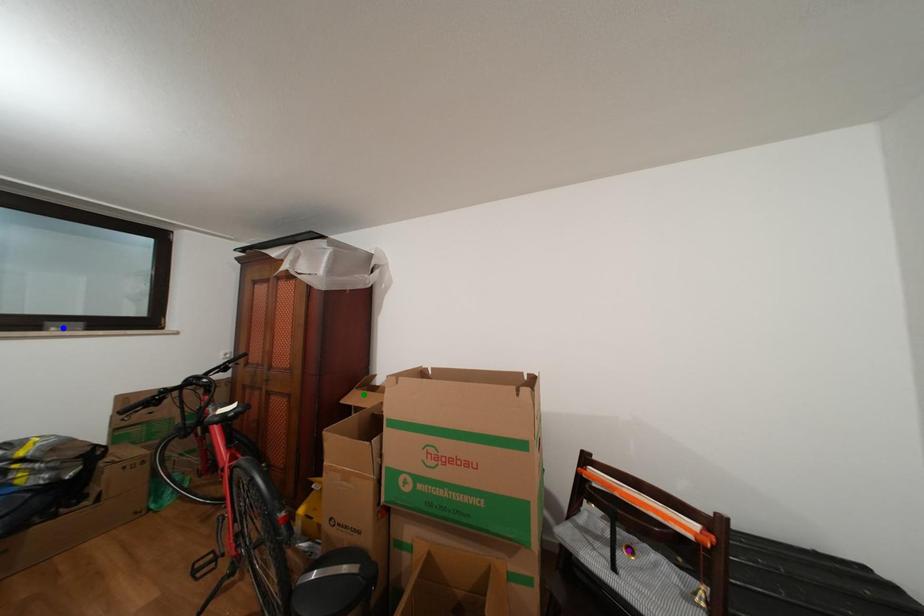
Order these from nearest to farthest:
1. blue point
2. green point
3. purple point

1. green point
2. blue point
3. purple point